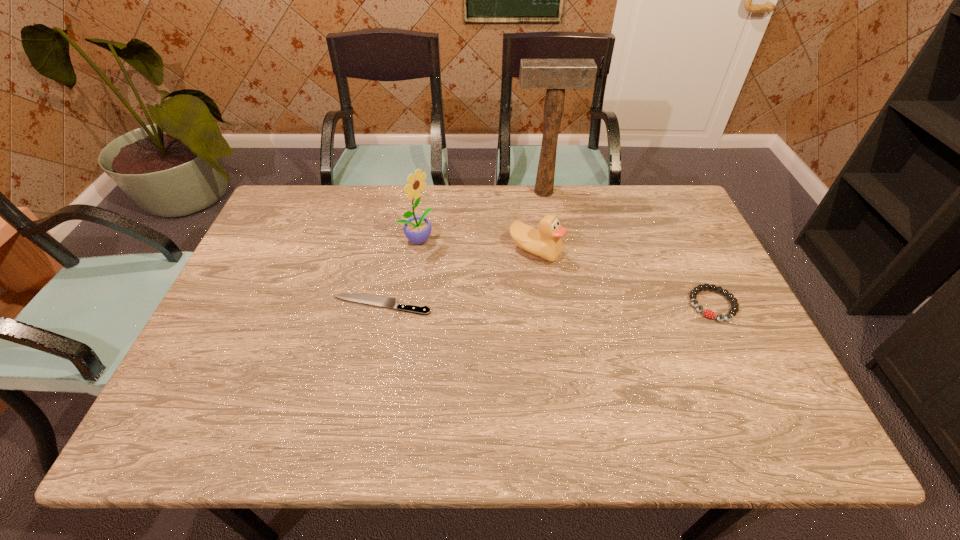
This screenshot has width=960, height=540. I want to click on object that is positioned at the right edge, so click(708, 313).

Where is `vacant area at the far edge of the desktop`? This screenshot has width=960, height=540. vacant area at the far edge of the desktop is located at coordinates (587, 227).

Identify the location of vacant space at the near edge of the desktop. (426, 370).

Identify the location of vacant region at the left edge of the desktop. (258, 266).

You are a GUI agent. You are given a task and a screenshot of the screen. Output one action in this format:
    pyautogui.click(x=<x>, y=<y>)
    Task: Click on the free space at the right edge
    This screenshot has width=960, height=540.
    Given the screenshot: What is the action you would take?
    pyautogui.click(x=700, y=242)

The image size is (960, 540). Find the location of `vacant space at the far left corner of the desktop`. vacant space at the far left corner of the desktop is located at coordinates (324, 186).

At what (x,y) coordinates should I click in order to perform the action: click on empty space that is in between the fourth shortest object and the rightmost object. Please return your answer as a coordinate pair (x, y). The image size is (960, 540). Looking at the image, I should click on coord(564,272).

At what (x,y) coordinates should I click in order to perform the action: click on vacant space that's between the duck and the steak knife. Please return your answer as a coordinate pair (x, y). The height and width of the screenshot is (540, 960). Looking at the image, I should click on (458, 278).

Locate an element on the screen. This screenshot has width=960, height=540. free spot between the shortest object and the fourth shortest object is located at coordinates (398, 272).

Image resolution: width=960 pixels, height=540 pixels. Find the location of `unoccupied area between the duck and the shortest object`. unoccupied area between the duck and the shortest object is located at coordinates (458, 278).